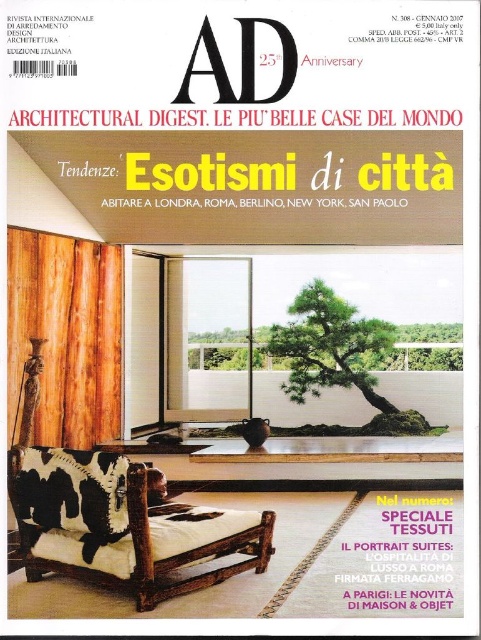
You are a photographer standing in front of the green textured bonsai at center and the green leafy tree at center. Which one is more to the left?

The green textured bonsai at center is positioned on the left side of the green leafy tree at center, so the green textured bonsai at center is more to the left.

You are an interior designer looking at the cover of Architectural Digest Italian edition. You see a green textured bonsai at center and a green leafy tree at center. Which one is positioned lower in the image?

The green textured bonsai at center is located below the green leafy tree at center, so it is positioned lower in the image.

You are standing in the room depicted on the cover of the Italian edition of Architectural Digest, January 2007. You notice two points marked on the cover at coordinates point (x=377, y=346) and point (x=400, y=353). Which of these points is closer to you?

Point (x=377, y=346) is in front of point (x=400, y=353), so it is closer to you.